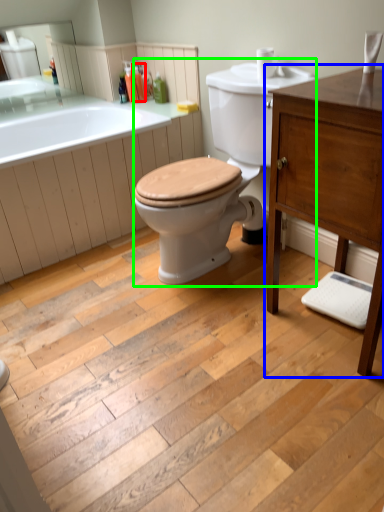
Question: Which object is the farthest from toiletry (highlighted by a red box)? Choose among these: bathroom cabinet (highlighted by a blue box) or porcelain (highlighted by a green box).

Choices:
 (A) bathroom cabinet
 (B) porcelain

Answer: (A)